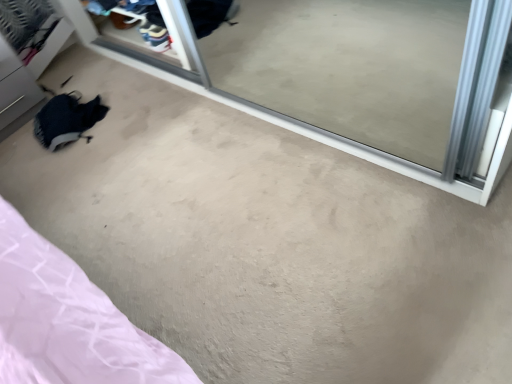
In order to face white leather sneakers at upper center, should I rotate leftwards or rightwards?

A 13.493 degree turn to the left will do.

The width and height of the screenshot is (512, 384). I want to click on white leather sneakers at upper center, so click(155, 37).

What do you see at coordinates (155, 37) in the screenshot? This screenshot has height=384, width=512. I see `white leather sneakers at upper center` at bounding box center [155, 37].

Where is `white leather sneakers at upper center`? white leather sneakers at upper center is located at coordinates (155, 37).